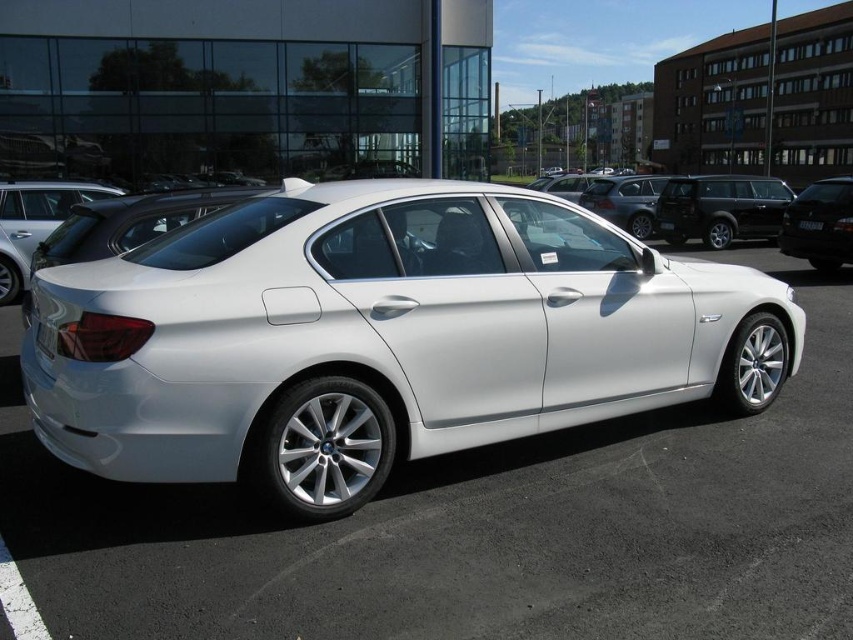
You are standing at the back of the white BMW sedan in the dealership lot. You see two points marked on the car. The first point is at coordinate point (830, 374) and the second is at point (805, 225). If you were to walk towards the front of the car, which point would you encounter first?

Point (830, 374) is in front of point (805, 225), so you would encounter point (830, 374) first as you walk towards the front of the car.

You are a delivery person trying to deliver a package to the dealership office located behind the cars. You need to go around the satin black sedan at right and the black plastic license plate at center. Which object should you go around first to reach the office?

The satin black sedan at right is in front of the black plastic license plate at center, so you should go around the satin black sedan at right first to reach the office.